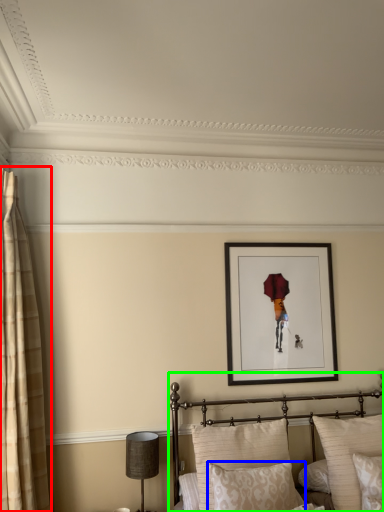
Question: Considering the real-world distances, which object is farthest from curtain (highlighted by a red box)? pillow (highlighted by a blue box) or bed (highlighted by a green box)?

Choices:
 (A) pillow
 (B) bed

Answer: (A)